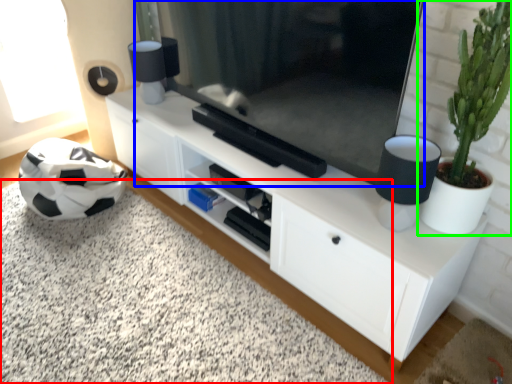
Question: Which object is positioned closest to plain (highlighted by a red box)? Select from television (highlighted by a blue box) and houseplant (highlighted by a green box).

Choices:
 (A) television
 (B) houseplant

Answer: (A)